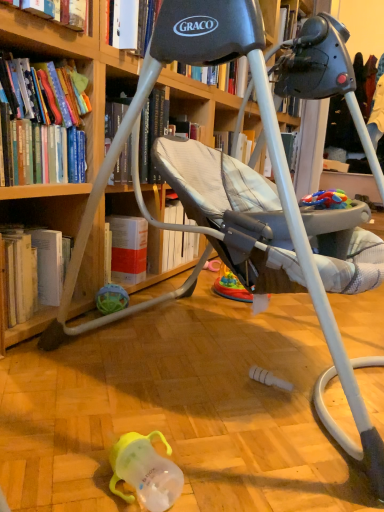
Find the location of a particular element. The height and width of the screenshot is (512, 384). vacant area that is situated to the right of translucent rubber ball at lower left, which appears as the first toy when viewed from the left is located at coordinates (155, 314).